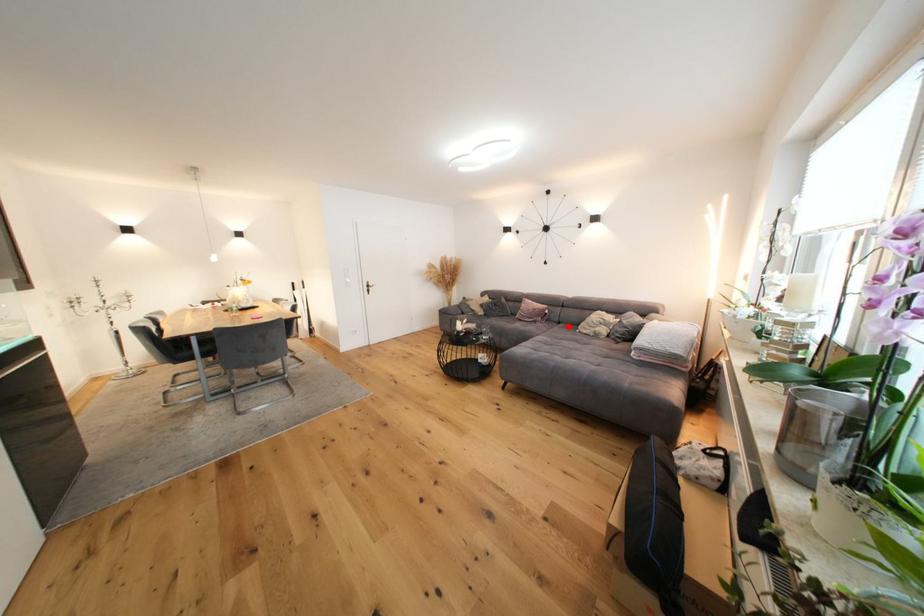
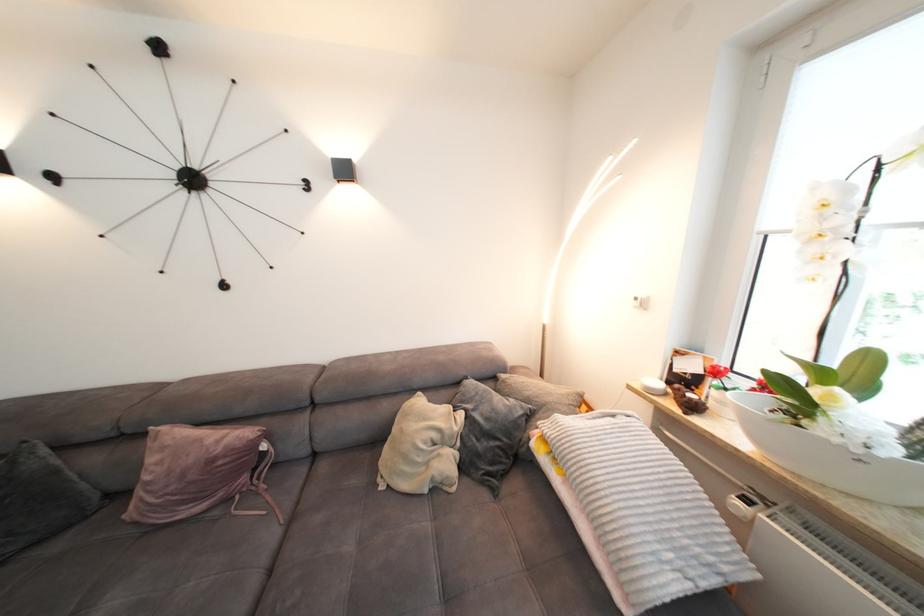
In the second image, find the point that corresponds to the highlighted location in the first image.

(330, 469)